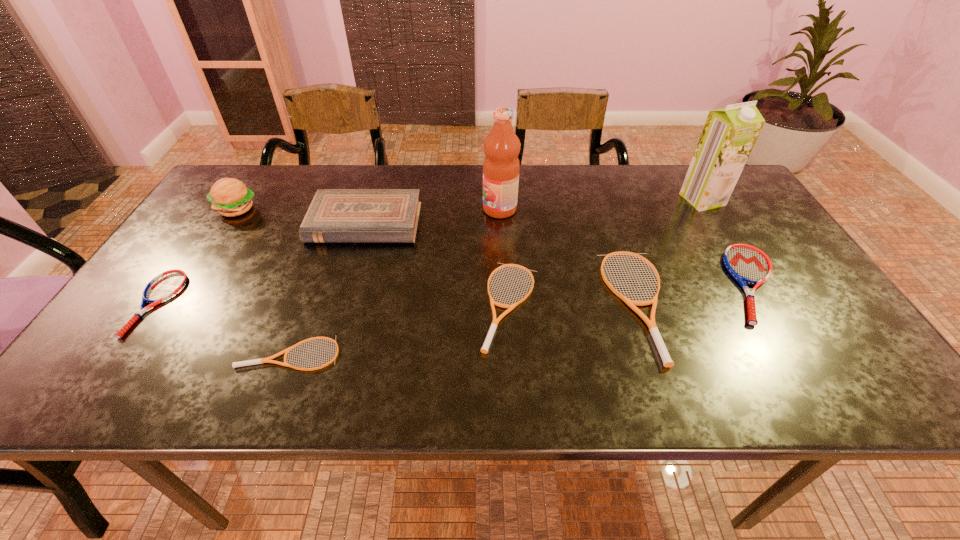
What are the coordinates of `vacant region at the far left corner of the desktop` in the screenshot? It's located at (263, 202).

The height and width of the screenshot is (540, 960). I want to click on free spot between the left blue tennis racket and the third tallest object, so [x=196, y=256].

The image size is (960, 540). What are the coordinates of `empty space that is in between the rightmost tennis racket and the blue Bible` in the screenshot? It's located at (559, 253).

Identify the location of free space that is in between the fruit juice and the bigger blue tennis racket. (626, 246).

At what (x,y) coordinates should I click in order to perform the action: click on free space between the rightmost beige tennis racket and the leftmost beige tennis racket. Please return your answer as a coordinate pair (x, y). Image resolution: width=960 pixels, height=540 pixels. Looking at the image, I should click on (464, 329).

Identify the location of vacant point located between the bigger blue tennis racket and the second tennis racket from left to right. [521, 319].

Locate an element on the screen. The width and height of the screenshot is (960, 540). empty location between the smaller blue tennis racket and the soya milk is located at coordinates (429, 252).

Locate an element on the screen. Image resolution: width=960 pixels, height=540 pixels. free space between the hamburger and the green soya milk is located at coordinates (469, 205).

The height and width of the screenshot is (540, 960). I want to click on vacant space that is in between the leftmost beige tennis racket and the third tallest object, so click(263, 281).

Locate an element on the screen. Image resolution: width=960 pixels, height=540 pixels. vacant space in between the leftmost beige tennis racket and the green soya milk is located at coordinates (496, 276).